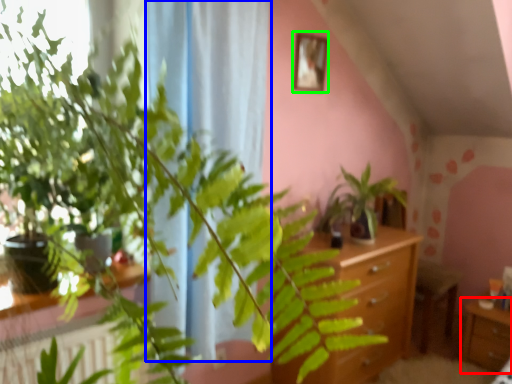
Question: Estimate the real-world distances between objects in this image. Which object is closer to table (highlighted by a red box), curtain (highlighted by a blue box) or picture frame (highlighted by a green box)?

Choices:
 (A) curtain
 (B) picture frame

Answer: (B)